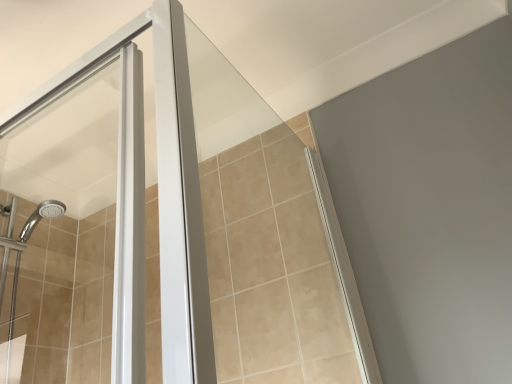
Identify the location of beige ceramic tile at center. (271, 268).

What do you see at coordinates (271, 268) in the screenshot? The height and width of the screenshot is (384, 512). I see `beige ceramic tile at center` at bounding box center [271, 268].

You are a GUI agent. You are given a task and a screenshot of the screen. Output one action in this format:
    pyautogui.click(x=<x>, y=<y>)
    Task: Click on the beige ceramic tile at center
    
    Given the screenshot: What is the action you would take?
    pyautogui.click(x=271, y=268)